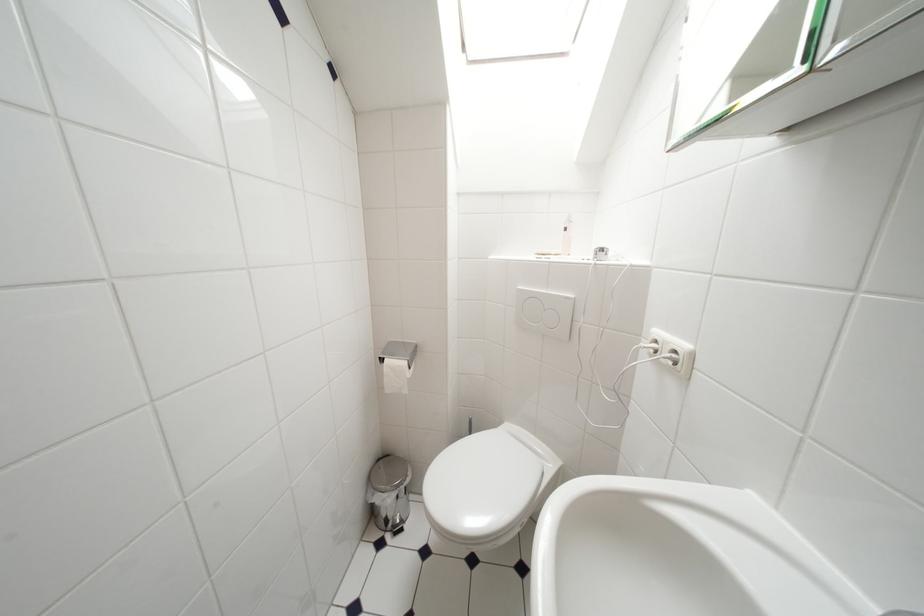
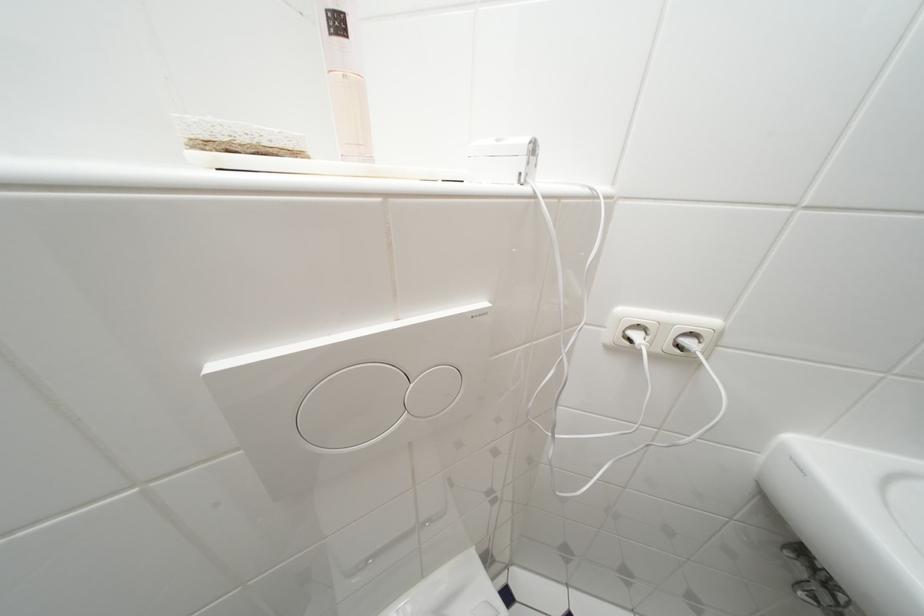
How did the camera likely rotate?

The camera's rotation is toward right-down.